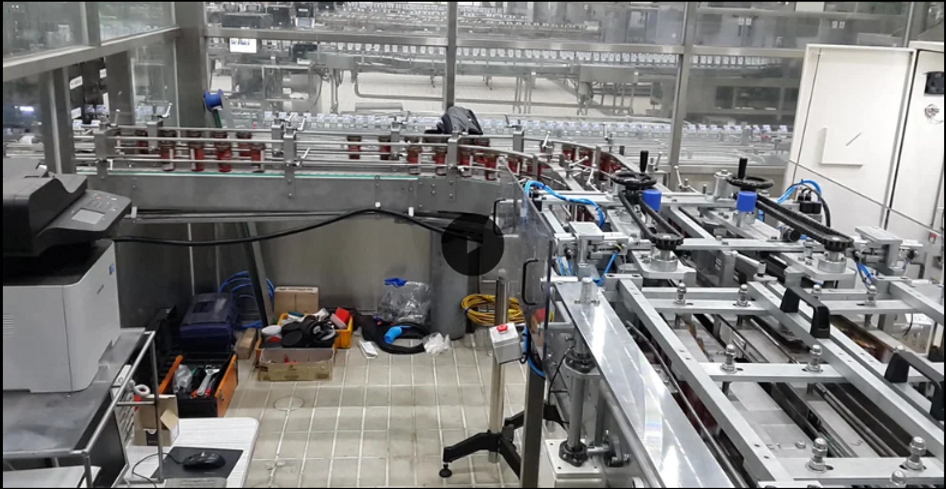
Locate an element on the screen. table is located at coordinates (40, 437).